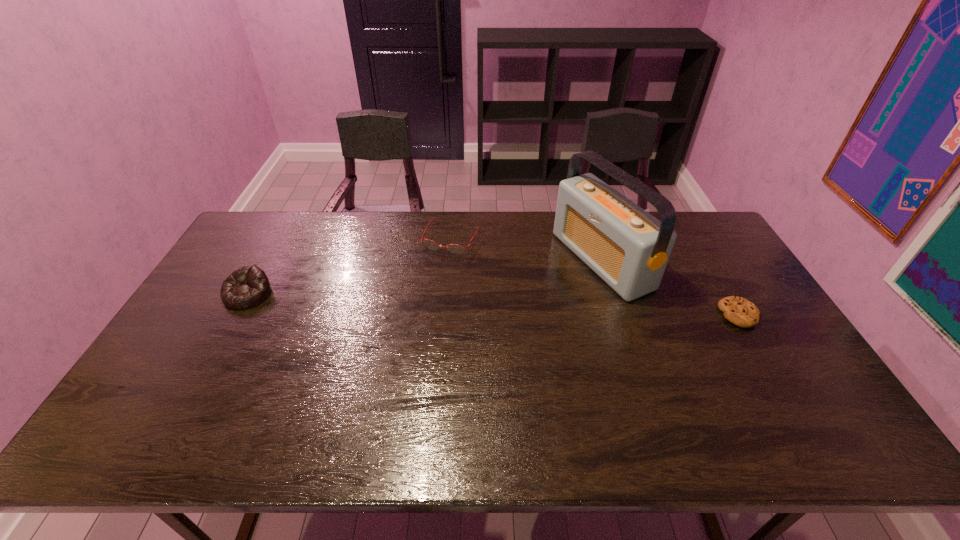
Image resolution: width=960 pixels, height=540 pixels. What are the coordinates of `free area in between the beanbag and the radio receiver` in the screenshot? It's located at (424, 278).

The height and width of the screenshot is (540, 960). I want to click on vacant space in between the shortest object and the beanbag, so click(493, 305).

The height and width of the screenshot is (540, 960). What are the coordinates of `vacant space in between the third object from right to left and the third object from left to right` in the screenshot? It's located at (526, 249).

The width and height of the screenshot is (960, 540). Find the location of `free space between the rightmost object and the third shortest object`. free space between the rightmost object and the third shortest object is located at coordinates (493, 305).

Image resolution: width=960 pixels, height=540 pixels. Identify the location of vacant space that is in between the third object from right to left and the leftmost object. (349, 266).

Locate an element on the screen. This screenshot has height=540, width=960. object that is the closest to the second object from left to right is located at coordinates (628, 248).

At what (x,y) coordinates should I click in order to perform the action: click on object that stands as the second closest to the third shortest object. Please return your answer as a coordinate pair (x, y). The width and height of the screenshot is (960, 540). Looking at the image, I should click on point(628,248).

Locate an element on the screen. free region that satisfies the following two spatial constraints: 1. on the front side of the third tallest object; 2. on the left side of the rightmost object is located at coordinates pyautogui.click(x=444, y=315).

The width and height of the screenshot is (960, 540). I want to click on free spot that satisfies the following two spatial constraints: 1. on the back side of the spectacles; 2. on the right side of the second tallest object, so click(279, 238).

At what (x,y) coordinates should I click in order to perform the action: click on vacant area that satisfies the following two spatial constraints: 1. on the back side of the third tallest object; 2. on the right side of the leftmost object. Please return your answer as a coordinate pair (x, y). The image size is (960, 540). Looking at the image, I should click on (279, 238).